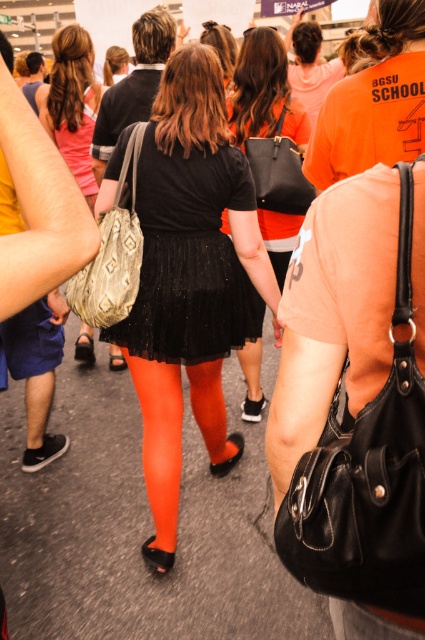
Who is more distant from viewer, [215,321] or [300,134]?

The point [300,134] is more distant.

Which is in front, point (138, 180) or point (255, 99)?

Point (138, 180) is more forward.

Locate an element on the screen. Image resolution: width=425 pixels, height=640 pixels. black glittery skirt at center is located at coordinates (189, 259).

Is point (172, 513) closer to viewer compared to point (334, 141)?

No, (172, 513) is behind (334, 141).

Which is more to the left, black glitter skirt at center or orange matte shirt at center?

black glitter skirt at center is more to the left.

Where is `black glitter skirt at center`? black glitter skirt at center is located at coordinates (189, 280).

The height and width of the screenshot is (640, 425). Describe the element at coordinates (189, 259) in the screenshot. I see `black glittery skirt at center` at that location.

How much distance is there between black glittery skirt at center and orange matte shirt at center?

They are 30.87 inches apart.

Which is behind, point (189, 248) or point (371, 58)?

The point (189, 248) is behind.

The width and height of the screenshot is (425, 640). I want to click on black glittery skirt at center, so click(x=189, y=259).